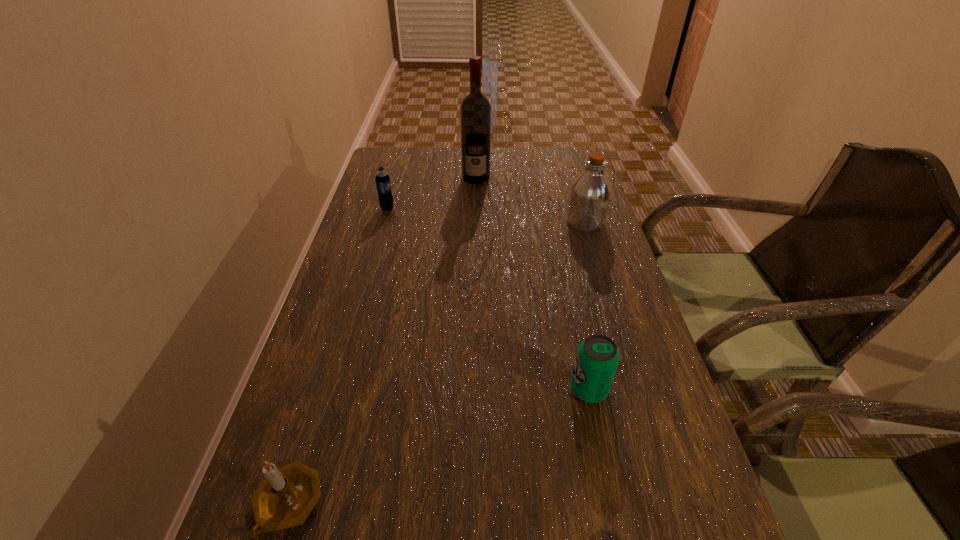
At what (x,y) coordinates should I click in order to perform the action: click on vacant space at the far right corner. Please return your answer as a coordinate pair (x, y). Looking at the image, I should click on (544, 166).

You are a GUI agent. You are given a task and a screenshot of the screen. Output one action in this format:
    pyautogui.click(x=<x>, y=<y>)
    Task: Click on the vacant point located between the nearer pop soda and the farther pop soda
    This screenshot has height=540, width=960.
    Given the screenshot: What is the action you would take?
    pyautogui.click(x=488, y=299)

What are the coordinates of `vacant space that's between the second nearest object and the rightmost object` in the screenshot? It's located at (587, 306).

Find the location of `free point between the fourth object from left to right and the farther pop soda`. free point between the fourth object from left to right and the farther pop soda is located at coordinates (488, 299).

Where is `free space between the rightmost object and the third object from right to left`? free space between the rightmost object and the third object from right to left is located at coordinates (531, 200).

You are a GUI agent. You are given a task and a screenshot of the screen. Output one action in this format:
    pyautogui.click(x=<x>, y=<y>)
    Task: Click on the empty space that is in between the farther pop soda and the second object from right to left
    The height and width of the screenshot is (540, 960).
    Given the screenshot: What is the action you would take?
    pyautogui.click(x=488, y=299)

Identify the location of empty space that is in between the farther pop soda and the tallest object. (432, 193).

Locate an element on the screen. The image size is (960, 540). free space between the second tallest object and the alcohol is located at coordinates (531, 200).

Where is `empty location between the alcohol and the farther pop soda`? empty location between the alcohol and the farther pop soda is located at coordinates (432, 193).

Locate which object ranks in proximity to the farther pop soda. Please provide its 2D coordinates. Your answer should be formatted as a tuple, i.e. [(x, y)], where the tuple contains the x and y coordinates of a point satisfying the conditions above.

[(475, 111)]